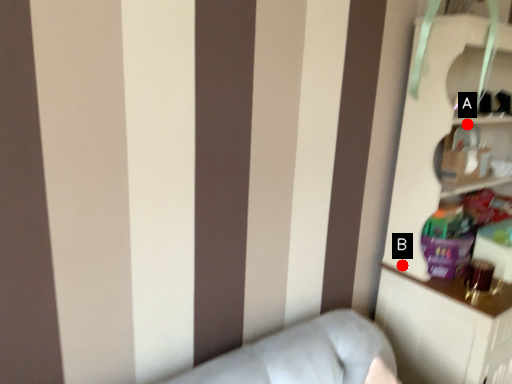
Question: Two points are circled on the image, labeled by A and B beside each circle. Which of the following is the closest to the observer?

Choices:
 (A) A is closer
 (B) B is closer

Answer: (B)